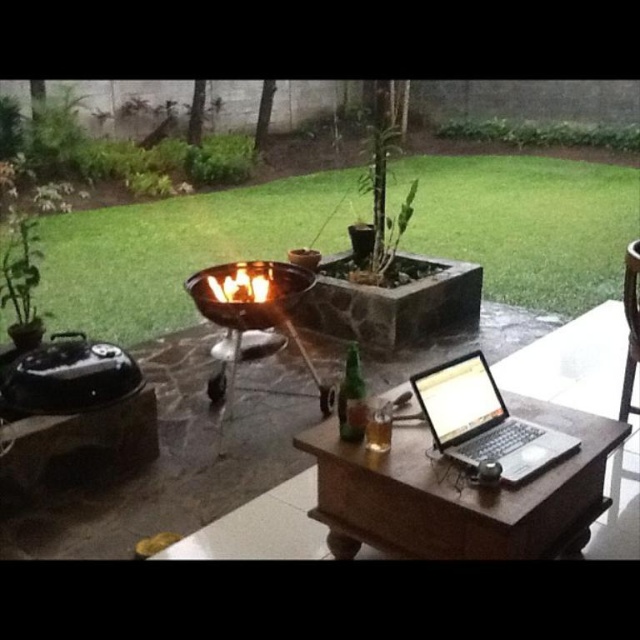
You are sitting on the brown wooden chair at right and want to reach the wooden table at center to grab your laptop. Which direction should you move to get to the table?

You should move to your left because the wooden table at center is positioned on the left side of the brown wooden chair at right.

You are a person who wants to sit at the brown wooden chair at right to work on the laptop on the wooden table at center. Considering the height difference between the two, will your arms be comfortable while working?

The wooden table at center has a lesser height compared to brown wooden chair at right, so when sitting at the brown wooden chair at right, your arms may be uncomfortable due to the table being lower than the chair seat.